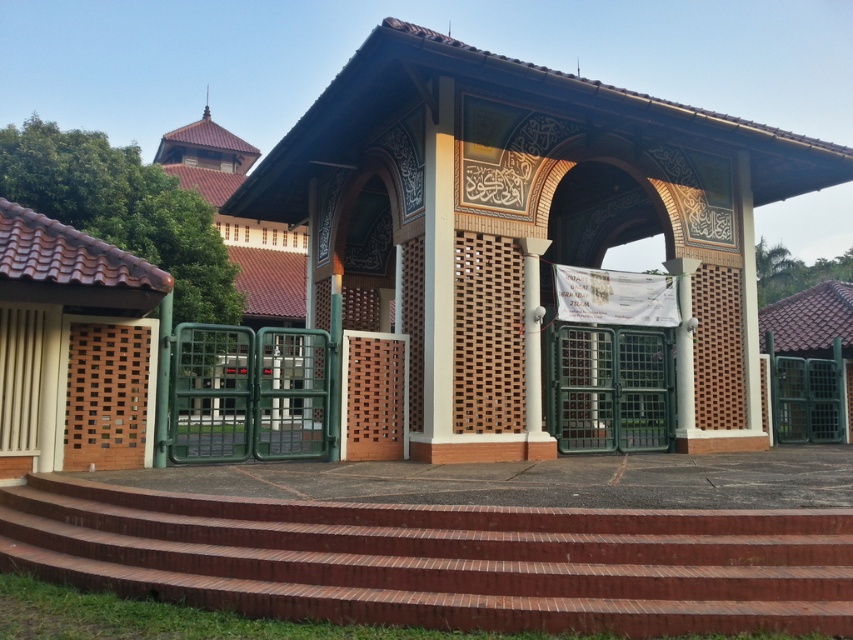
You are a visitor approaching the entrance of the mosque. You see the brown textured gate at center and the red brick stairs at center. Which object is higher in position?

The brown textured gate at center is above the red brick stairs at center, so the brown textured gate at center is higher in position.

You are standing at the bottom of the red brick stairs at center and want to enter through the brown textured gate at center. Which direction should you walk to reach the gate?

The brown textured gate at center is to the right of the red brick stairs at center, so you should walk to the right to reach the gate.

Consider the image. You are a visitor approaching the entrance of this building. You notice the brown textured gate at center and the red brick stairs at center. Which object is bigger in size?

The brown textured gate at center is larger in size compared to the red brick stairs at center according to the description.